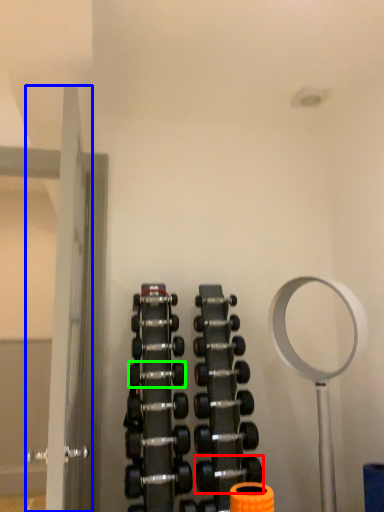
Question: Which object is the closest to the dumbbell (highlighted by a red box)? Choose among these: door (highlighted by a blue box) or dumbbell (highlighted by a green box).

Choices:
 (A) door
 (B) dumbbell

Answer: (B)